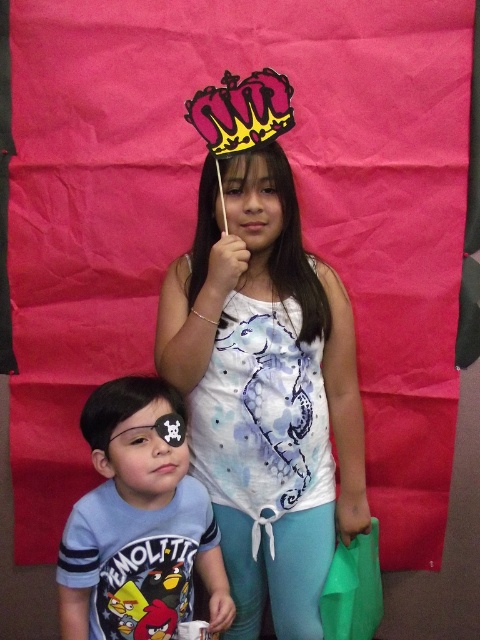
Measure the distance from matte white tank top at center to blue cotton shirt at lower left.

The distance of matte white tank top at center from blue cotton shirt at lower left is 8.56 inches.

Between matte white tank top at center and blue cotton shirt at lower left, which one is positioned lower?

blue cotton shirt at lower left is below.

Who is more forward, (227, 557) or (86, 579)?

Point (86, 579) is more forward.

Where is `matte white tank top at center`? matte white tank top at center is located at coordinates (264, 364).